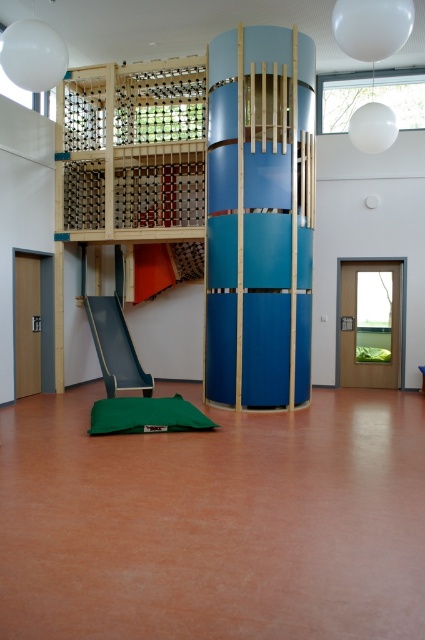
Is blue glossy pillar at center thinner than teal glossy slide at lower left?

No, blue glossy pillar at center is not thinner than teal glossy slide at lower left.

Can you confirm if blue glossy pillar at center is taller than teal glossy slide at lower left?

Indeed, blue glossy pillar at center has a greater height compared to teal glossy slide at lower left.

Between point (246, 317) and point (124, 317), which one is positioned behind?

Positioned behind is point (124, 317).

In order to click on blue glossy pillar at center in this screenshot , I will do `click(260, 218)`.

Between wooden bunk bed at left and teal glossy slide at lower left, which one is positioned lower?

Positioned lower is teal glossy slide at lower left.

Is wooden bunk bed at left to the left of teal glossy slide at lower left from the viewer's perspective?

No, wooden bunk bed at left is not to the left of teal glossy slide at lower left.

What do you see at coordinates (218, 198) in the screenshot? I see `wooden bunk bed at left` at bounding box center [218, 198].

Find the location of a particular element. This screenshot has height=640, width=425. wooden bunk bed at left is located at coordinates click(x=218, y=198).

Does wooden bunk bed at left appear on the right side of green fabric mat at center?

→ Correct, you'll find wooden bunk bed at left to the right of green fabric mat at center.

Is wooden bunk bed at left thinner than green fabric mat at center?

Indeed, wooden bunk bed at left has a lesser width compared to green fabric mat at center.

This screenshot has height=640, width=425. I want to click on wooden bunk bed at left, so pos(218,198).

The image size is (425, 640). What are the coordinates of `wooden bunk bed at left` in the screenshot? It's located at (218, 198).